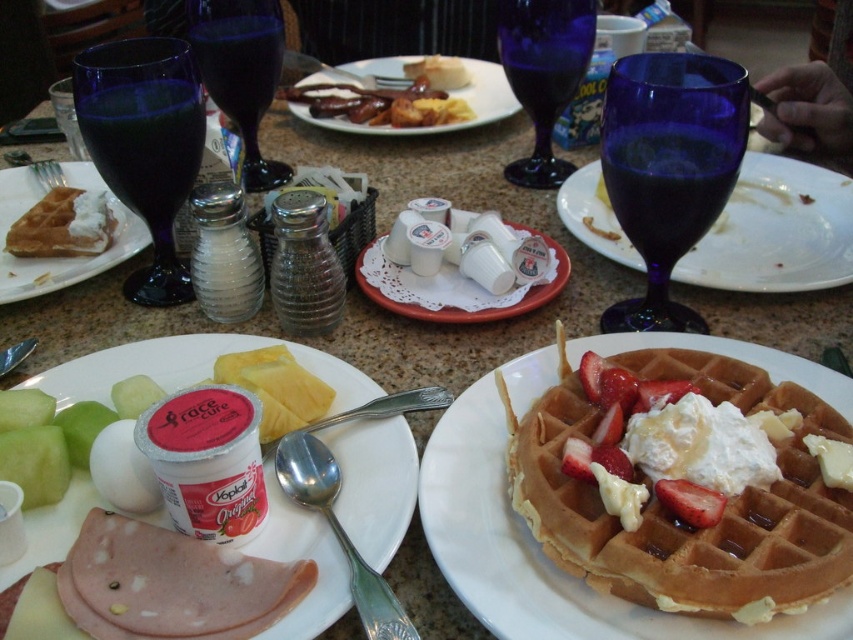
Question: Is transparent blue glass at upper left wider than white paper plate at center?

Choices:
 (A) no
 (B) yes

Answer: (A)

Question: Which point appears closest to the camera in this image?

Choices:
 (A) (370, 394)
 (B) (583, 61)
 (C) (700, 200)

Answer: (A)

Question: Which of these objects is positioned farthest from the matte white plate at center?

Choices:
 (A) transparent glass at right
 (B) transparent blue glass at upper left
 (C) transparent blue glass at upper center
 (D) blue glass at center

Answer: (A)

Question: Is golden brown waffle with cream and strawberries at center further to the viewer compared to matte glass plate at center?

Choices:
 (A) no
 (B) yes

Answer: (A)

Question: Estimate the real-world distances between objects in this image. Which object is farther from the white matte plate at center?

Choices:
 (A) matte white plate at center
 (B) transparent blue glass at upper right
 (C) white matte waffle at center

Answer: (A)

Question: Is the position of transparent blue glass at upper left more distant than that of white paper plate at center?

Choices:
 (A) yes
 (B) no

Answer: (B)